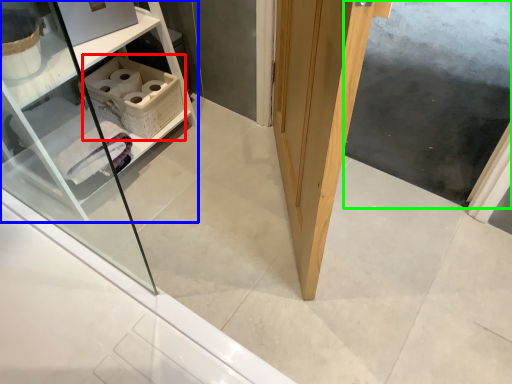
Question: Considering the real-world distances, which object is farthest from cabinetry (highlighted by a red box)? shelf (highlighted by a blue box) or screen door (highlighted by a green box)?

Choices:
 (A) shelf
 (B) screen door

Answer: (B)